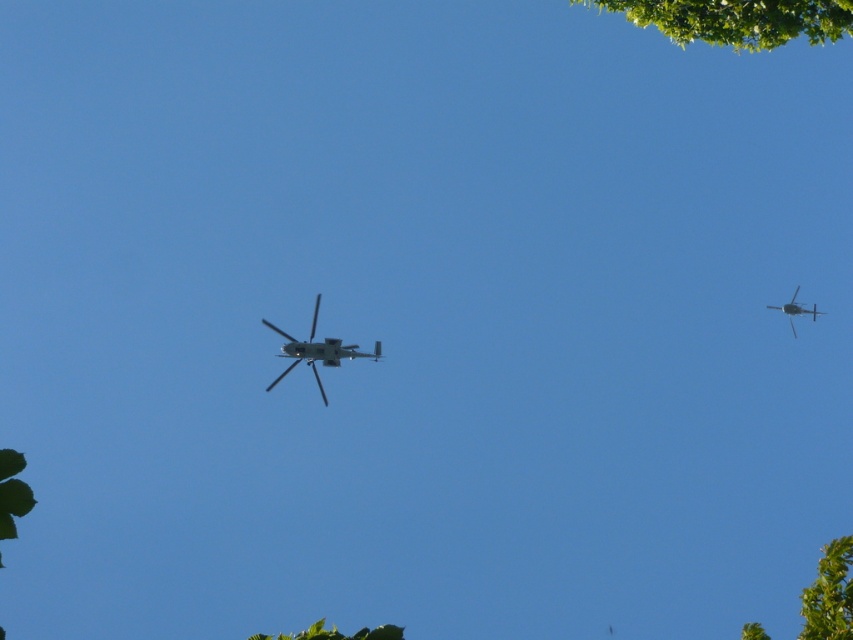
Is green leafy tree at upper right further to the viewer compared to green leafy tree at lower right?

Yes, green leafy tree at upper right is behind green leafy tree at lower right.

Is green leafy tree at upper right positioned before green leafy tree at lower right?

That is False.

Who is more distant from viewer, (x=722, y=4) or (x=816, y=589)?

Point (x=722, y=4)

The image size is (853, 640). What are the coordinates of `green leafy tree at upper right` in the screenshot? It's located at (737, 19).

Describe the element at coordinates (317, 352) in the screenshot. The image size is (853, 640). I see `metallic gray helicopter at center` at that location.

Is point (292, 353) closer to camera compared to point (769, 307)?

Yes.

Locate an element on the screen. The width and height of the screenshot is (853, 640). metallic gray helicopter at center is located at coordinates (317, 352).

Does point (657, 1) lie behind point (807, 314)?

No, it is not.

Can you confirm if green leafy tree at upper right is wider than metallic gray helicopter at right?

Indeed, green leafy tree at upper right has a greater width compared to metallic gray helicopter at right.

The image size is (853, 640). What are the coordinates of `green leafy tree at upper right` in the screenshot? It's located at (737, 19).